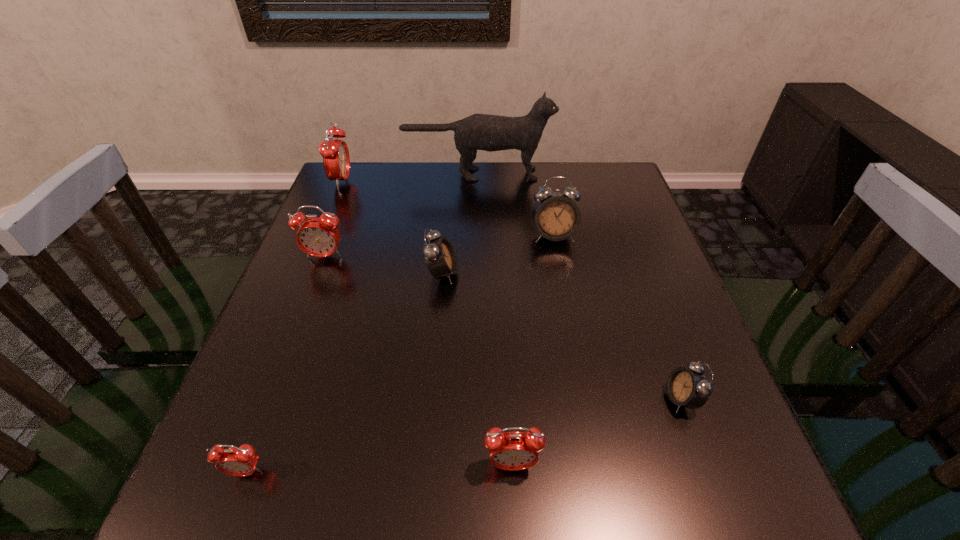
Identify the location of free space located 0.260m on the face of the rightmost alarm clock. Image resolution: width=960 pixels, height=540 pixels. (520, 399).

Locate an element on the screen. The image size is (960, 540). free region located on the face of the rightmost alarm clock is located at coordinates (559, 399).

The width and height of the screenshot is (960, 540). Identify the location of blank area located on the face of the smallest red alarm clock. (228, 523).

The image size is (960, 540). What are the coordinates of `cat that is at the far edge` in the screenshot? It's located at (486, 132).

Image resolution: width=960 pixels, height=540 pixels. Find the location of `alarm clock located in the far edge section of the desktop`. alarm clock located in the far edge section of the desktop is located at coordinates (335, 153).

Find the location of `object that is at the right edge`. object that is at the right edge is located at coordinates (689, 387).

What are the coordinates of `object that is at the far left corner` in the screenshot? It's located at (335, 153).

Identify the location of object at the near left corner. (241, 461).

In order to click on blank space at the far edge of the desktop in this screenshot , I will do `click(417, 194)`.

This screenshot has height=540, width=960. In order to click on vacant region at the left edge of the desktop in this screenshot , I will do `click(363, 240)`.